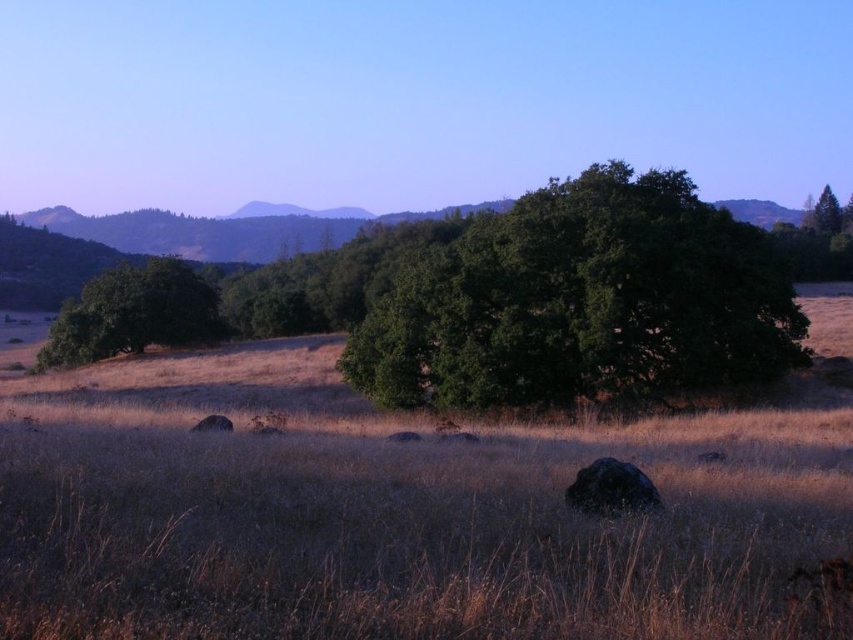
Question: Considering the relative positions of green leafy tree at center and green matte tree at upper right in the image provided, where is green leafy tree at center located with respect to green matte tree at upper right?

Choices:
 (A) above
 (B) below

Answer: (B)

Question: Which of the following is the farthest from the observer?

Choices:
 (A) green leafy tree at center
 (B) green leafy tree at left

Answer: (B)

Question: Which of the following is the farthest from the observer?

Choices:
 (A) green matte tree at upper right
 (B) green leafy tree at left

Answer: (A)

Question: Can you confirm if green leafy tree at center is positioned to the right of green matte tree at upper right?

Choices:
 (A) no
 (B) yes

Answer: (A)

Question: Which point is closer to the camera?

Choices:
 (A) (686, 198)
 (B) (140, 298)
 (C) (827, 202)

Answer: (A)

Question: Can you confirm if green leafy tree at left is wider than green matte tree at upper right?

Choices:
 (A) yes
 (B) no

Answer: (B)